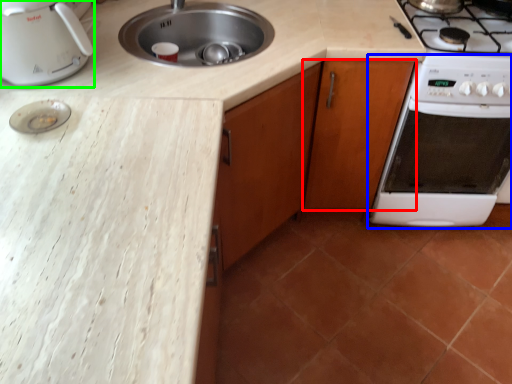
Question: Considering the real-world distances, which object is closest to cabinetry (highlighted by a red box)? oven (highlighted by a blue box) or kitchen appliance (highlighted by a green box).

Choices:
 (A) oven
 (B) kitchen appliance

Answer: (A)